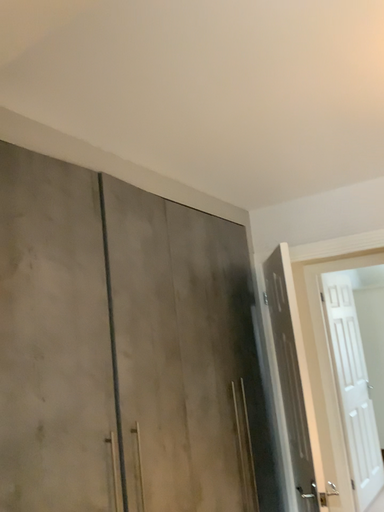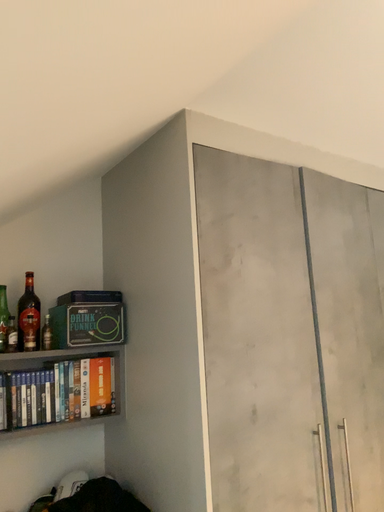
Question: Which way did the camera rotate in the video?

Choices:
 (A) rotated right
 (B) rotated left

Answer: (B)